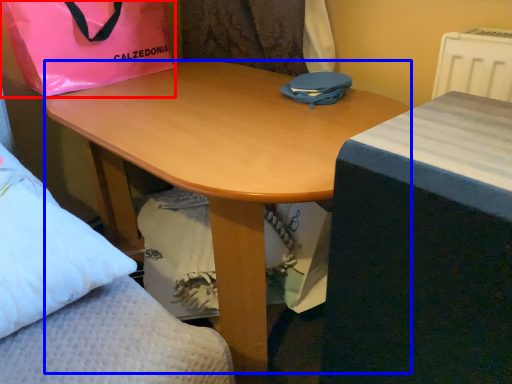
Question: Which point is further to the camera, bag (highlighted by a red box) or desk (highlighted by a blue box)?

Choices:
 (A) bag
 (B) desk

Answer: (A)